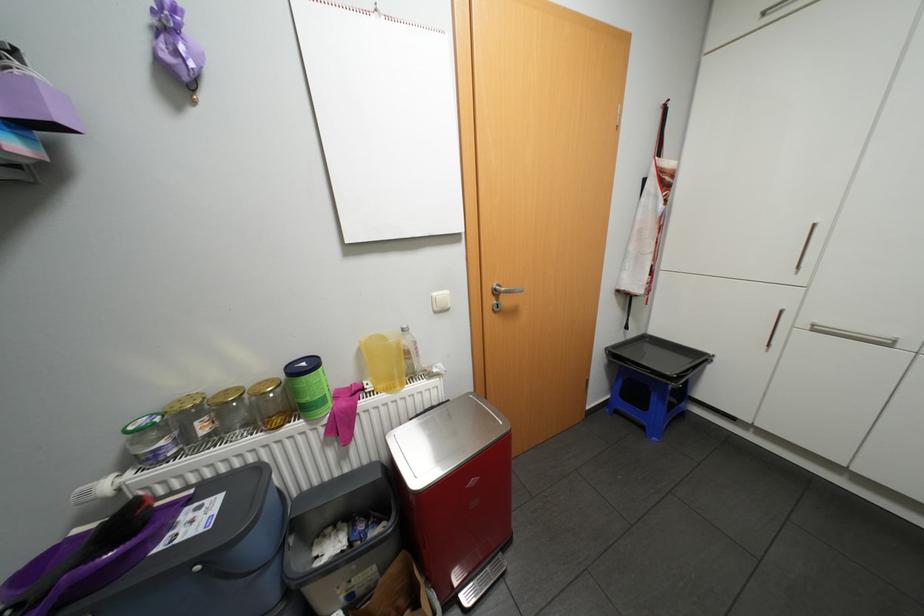
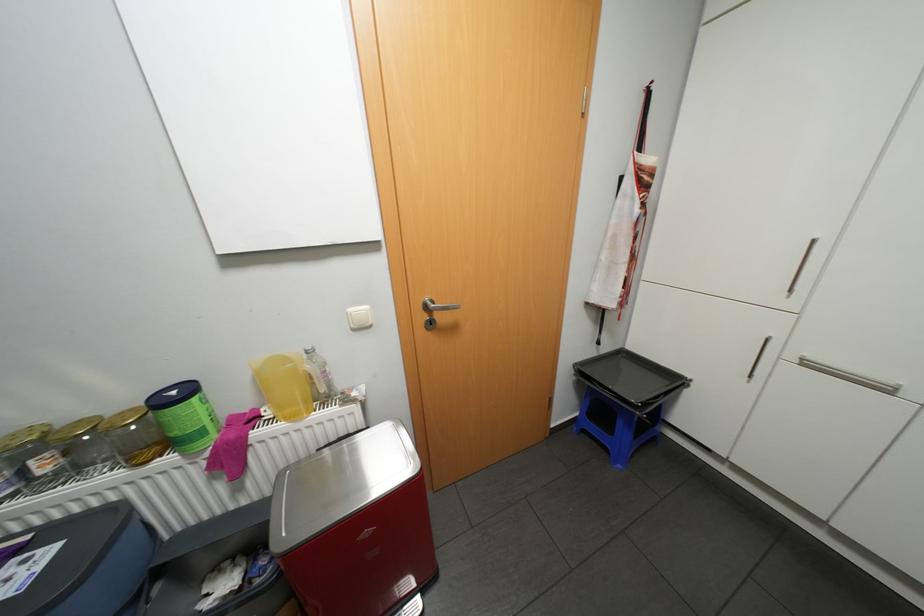
Find the pixel in the second image that matches [235,389] in the first image.

(88, 419)